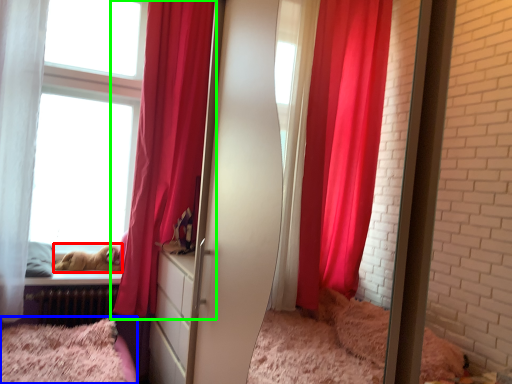
Question: Based on their relative distances, which object is nearer to animal (highlighted by a red box)? Choose from bed (highlighted by a blue box) and curtain (highlighted by a green box).

Choices:
 (A) bed
 (B) curtain

Answer: (A)